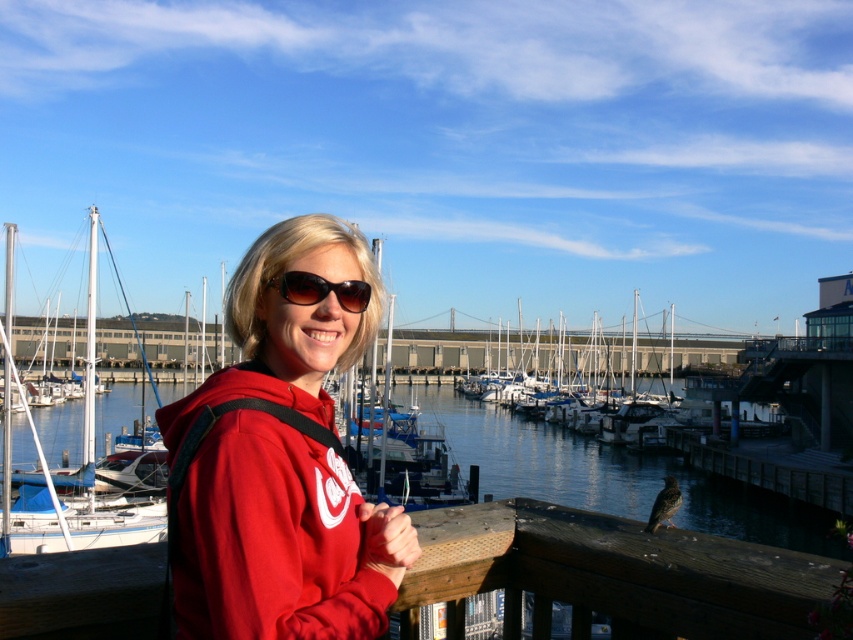
Question: Which object is the farthest from the matte blue sailboat at center?

Choices:
 (A) white glossy boats at center
 (B) matte red hoodie at center
 (C) white glossy sailboat at left
 (D) sunglasses at center

Answer: (A)

Question: Can you confirm if white glossy sailboat at left is bigger than sunglasses at center?

Choices:
 (A) yes
 (B) no

Answer: (A)

Question: Among these points, which one is nearest to the camera?

Choices:
 (A) (219, 568)
 (B) (91, 376)
 (C) (413, 348)
 (D) (279, 288)

Answer: (A)

Question: Which point is closer to the camera?

Choices:
 (A) white glossy sailboat at left
 (B) matte blue sailboat at center

Answer: (B)

Question: Observing the image, what is the correct spatial positioning of matte red hoodie at center in reference to white glossy boats at center?

Choices:
 (A) below
 (B) above

Answer: (B)

Question: Does white glossy boats at center come in front of sunglasses at center?

Choices:
 (A) yes
 (B) no

Answer: (B)